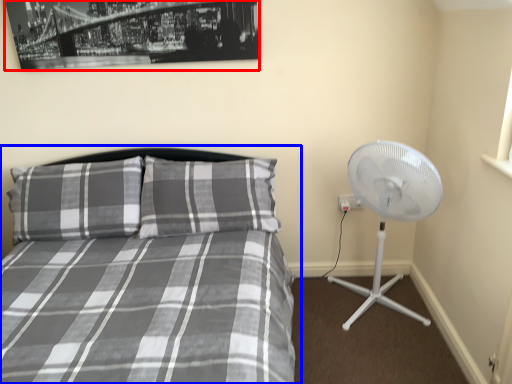
Question: Which of the following is the closest to the observer, picture frame (highlighted by a red box) or bed (highlighted by a blue box)?

Choices:
 (A) picture frame
 (B) bed

Answer: (B)